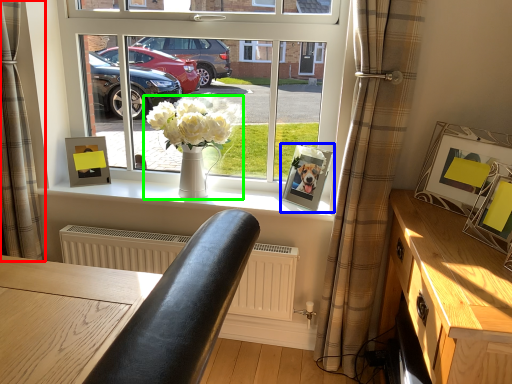
Question: Estimate the real-world distances between objects in this image. Which object is farther from curtain (highlighted by a red box), picture frame (highlighted by a blue box) or houseplant (highlighted by a green box)?

Choices:
 (A) picture frame
 (B) houseplant

Answer: (A)